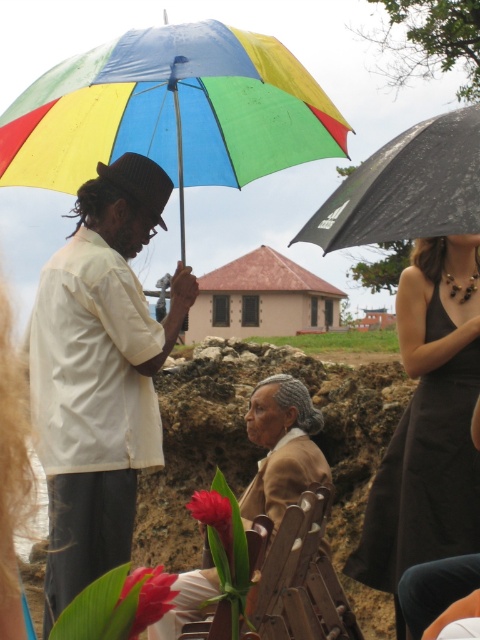
You are a photographer trying to capture a candid shot of the white matte shirt at center and the black matte umbrella at upper right. To ensure both subjects are in focus, you need to know their relative heights. Which object is taller?

The white matte shirt at center is taller than the black matte umbrella at upper right according to the description.

In the scene shown: You are at a gathering and see the white matte shirt at center and the rainbow fabric umbrella at upper left. Which object is positioned to the right of the other?

The white matte shirt at center is positioned to the right of the rainbow fabric umbrella at upper left.